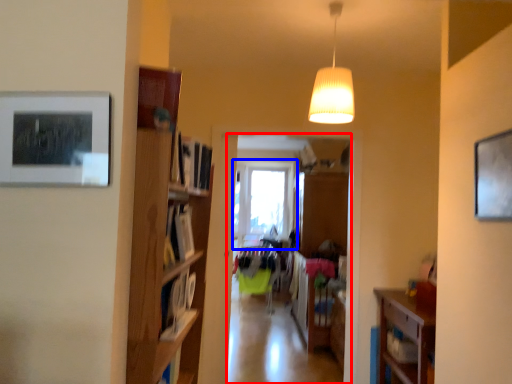
Question: Which point is closer to the camera, clothing store (highlighted by a red box) or window (highlighted by a blue box)?

Choices:
 (A) clothing store
 (B) window

Answer: (A)